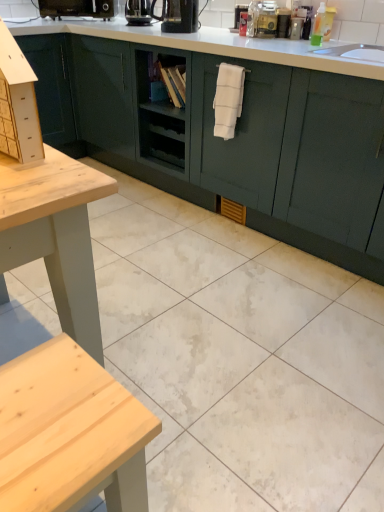
Question: From a real-world perspective, is black plastic coffee machine at upper center, arranged as the third coffee machine when viewed from the left, located higher than black glossy coffee machine at upper center, placed as the second coffee machine when sorted from left to right?

Choices:
 (A) yes
 (B) no

Answer: (A)

Question: From a real-world perspective, is black plastic coffee machine at upper center, which ranks as the 1th coffee machine in front-to-back order, beneath black glossy coffee machine at upper center, acting as the second coffee machine starting from the front?

Choices:
 (A) no
 (B) yes

Answer: (A)

Question: Is black plastic coffee machine at upper center, which ranks as the 1th coffee machine in front-to-back order, at the right side of black glossy coffee machine at upper center, acting as the second coffee machine starting from the front?

Choices:
 (A) yes
 (B) no

Answer: (A)

Question: Is black plastic coffee machine at upper center, arranged as the third coffee machine when viewed from the left, positioned far away from black glossy coffee machine at upper center, acting as the second coffee machine starting from the front?

Choices:
 (A) yes
 (B) no

Answer: (B)

Question: Is black plastic coffee machine at upper center, which ranks as the 1th coffee machine in front-to-back order, positioned beyond the bounds of black glossy coffee machine at upper center, which is the 2th coffee machine in back-to-front order?

Choices:
 (A) yes
 (B) no

Answer: (A)

Question: Is black plastic coffee machine at upper center, which ranks as the 1th coffee machine in front-to-back order, positioned in front of black glossy coffee machine at upper center, acting as the second coffee machine starting from the front?

Choices:
 (A) no
 (B) yes

Answer: (B)

Question: Can you confirm if translucent plastic bottle at upper center is thinner than black plastic coffee machine at upper left, arranged as the third coffee machine when viewed from the right?

Choices:
 (A) no
 (B) yes

Answer: (B)

Question: Is translucent plastic bottle at upper center touching black plastic coffee machine at upper left, which is counted as the first coffee machine, starting from the back?

Choices:
 (A) yes
 (B) no

Answer: (B)

Question: Is translucent plastic bottle at upper center positioned beyond the bounds of black plastic coffee machine at upper left, arranged as the third coffee machine when viewed from the right?

Choices:
 (A) yes
 (B) no

Answer: (A)

Question: Does translucent plastic bottle at upper center appear on the left side of black plastic coffee machine at upper left, which is counted as the first coffee machine, starting from the back?

Choices:
 (A) yes
 (B) no

Answer: (B)

Question: Can black plastic coffee machine at upper left, which is counted as the first coffee machine, starting from the back, be found inside translucent plastic bottle at upper center?

Choices:
 (A) yes
 (B) no

Answer: (B)

Question: From the image's perspective, is translucent plastic bottle at upper center above black plastic coffee machine at upper left, the third coffee machine when ordered from front to back?

Choices:
 (A) no
 (B) yes

Answer: (A)

Question: Is white glossy tile at center bigger than translucent plastic bottle at upper center?

Choices:
 (A) no
 (B) yes

Answer: (B)